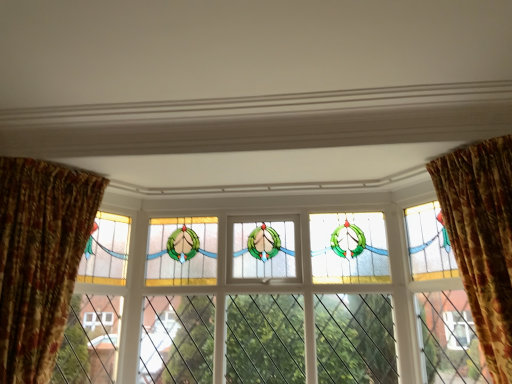
Question: Should I look upward or downward to see stained glass window at center?

Choices:
 (A) down
 (B) up

Answer: (A)

Question: Is floral fabric curtain at right, which appears as the 2th curtain when viewed from the left, oriented away from floral velvet curtain at left, acting as the 1th curtain starting from the left?

Choices:
 (A) yes
 (B) no

Answer: (A)

Question: From the image's perspective, is floral fabric curtain at right, which appears as the 2th curtain when viewed from the left, located above floral velvet curtain at left, acting as the 1th curtain starting from the left?

Choices:
 (A) no
 (B) yes

Answer: (B)

Question: Is floral fabric curtain at right, which is counted as the first curtain, starting from the right, taller than floral velvet curtain at left, which is the second curtain in right-to-left order?

Choices:
 (A) no
 (B) yes

Answer: (A)

Question: Is the depth of floral fabric curtain at right, which is counted as the first curtain, starting from the right, greater than that of floral velvet curtain at left, which is the second curtain in right-to-left order?

Choices:
 (A) yes
 (B) no

Answer: (B)

Question: From the image's perspective, does floral fabric curtain at right, which is counted as the first curtain, starting from the right, appear lower than floral velvet curtain at left, acting as the 1th curtain starting from the left?

Choices:
 (A) no
 (B) yes

Answer: (A)

Question: Can you confirm if floral fabric curtain at right, which is counted as the first curtain, starting from the right, is shorter than floral velvet curtain at left, acting as the 1th curtain starting from the left?

Choices:
 (A) yes
 (B) no

Answer: (A)

Question: From a real-world perspective, is stained glass window at center positioned under floral fabric curtain at right, which is counted as the first curtain, starting from the right, based on gravity?

Choices:
 (A) no
 (B) yes

Answer: (B)

Question: From the image's perspective, is stained glass window at center located beneath floral fabric curtain at right, which appears as the 2th curtain when viewed from the left?

Choices:
 (A) yes
 (B) no

Answer: (A)

Question: From a real-world perspective, is stained glass window at center physically above floral fabric curtain at right, which is counted as the first curtain, starting from the right?

Choices:
 (A) no
 (B) yes

Answer: (A)

Question: Does stained glass window at center have a larger size compared to floral fabric curtain at right, which appears as the 2th curtain when viewed from the left?

Choices:
 (A) yes
 (B) no

Answer: (B)

Question: Is stained glass window at center positioned far away from floral fabric curtain at right, which appears as the 2th curtain when viewed from the left?

Choices:
 (A) no
 (B) yes

Answer: (A)

Question: Is stained glass window at center placed right next to floral fabric curtain at right, which appears as the 2th curtain when viewed from the left?

Choices:
 (A) no
 (B) yes

Answer: (A)

Question: Does floral velvet curtain at left, acting as the 1th curtain starting from the left, have a greater width compared to stained glass window at right?

Choices:
 (A) no
 (B) yes

Answer: (B)